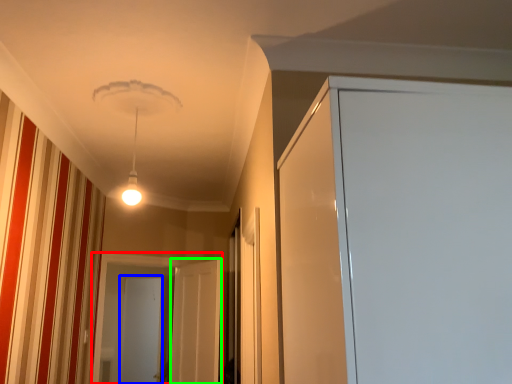
Question: Which object is positioned closest to screen door (highlighted by a red box)? Select from screen door (highlighted by a blue box) and screen door (highlighted by a green box).

Choices:
 (A) screen door
 (B) screen door

Answer: (B)